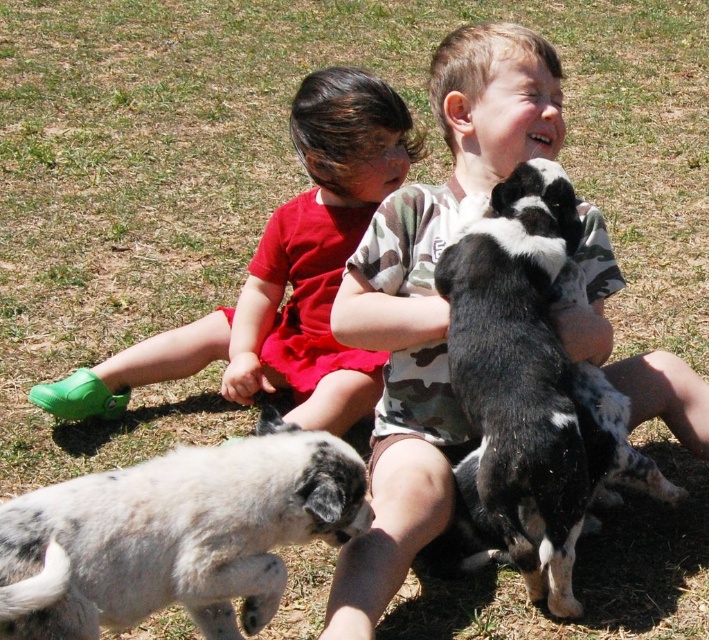
You are standing at the point marked as point (396,545) in the image. You want to throw a ball to a friend who is 1.5 meters away from you. Is your friend within reach?

The distance between you and the viewer is 2.09 meters, which is greater than 1.5 meters. Therefore, your friend is out of reach.

From the picture: You are a photographer trying to capture a photo of the speckled fur puppy at lower left and the black and white fur at upper center. Which puppy is positioned to the left side of the other?

The speckled fur puppy at lower left is to the left of black and white fur at upper center.